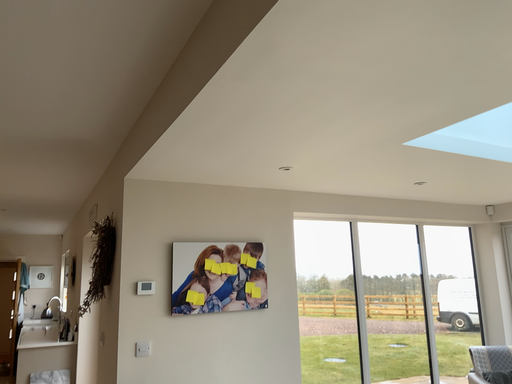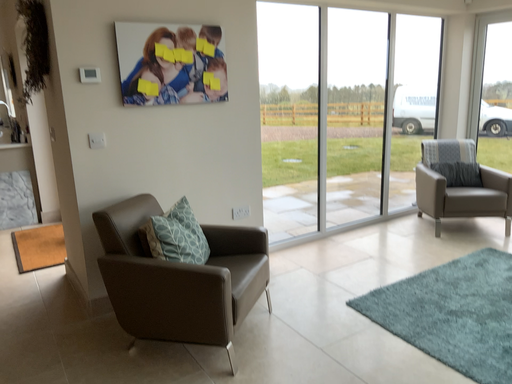
Question: How did the camera likely rotate when shooting the video?

Choices:
 (A) rotated downward
 (B) rotated upward

Answer: (A)